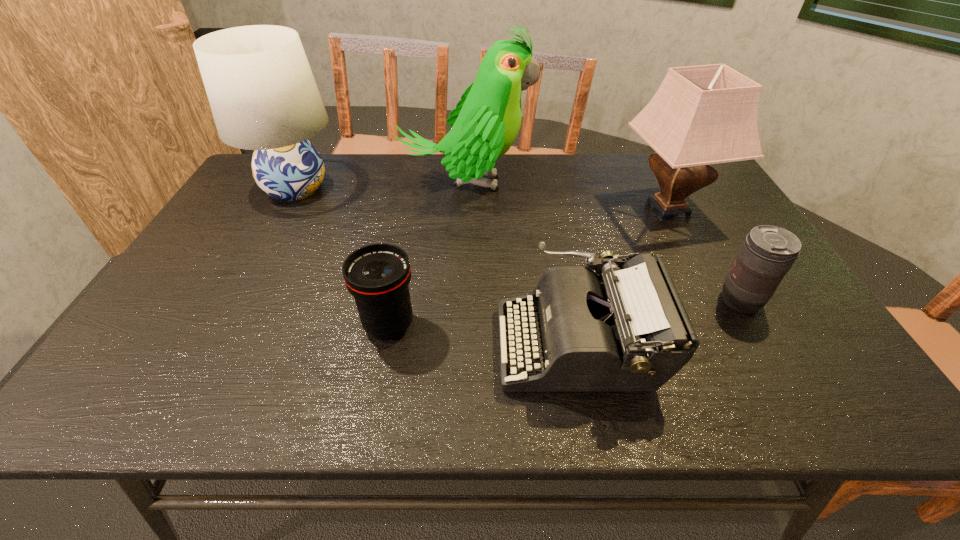
What are the coordinates of `telephoto lens present at the right edge` in the screenshot? It's located at (768, 252).

Locate an element on the screen. The width and height of the screenshot is (960, 540). object present at the far left corner is located at coordinates (263, 96).

Where is `object at the far right corner`? The height and width of the screenshot is (540, 960). object at the far right corner is located at coordinates (700, 115).

You are a GUI agent. You are given a task and a screenshot of the screen. Output one action in this format:
    pyautogui.click(x=<x>, y=<y>)
    Task: Click on the free space at the far edge of the desktop
    
    Given the screenshot: What is the action you would take?
    pos(639,166)

The image size is (960, 540). I want to click on vacant space at the near edge of the desktop, so click(600, 400).

You are a GUI agent. You are given a task and a screenshot of the screen. Output one action in this format:
    pyautogui.click(x=<x>, y=<y>)
    Task: Click on the vacant space at the left edge of the desktop
    Image resolution: width=960 pixels, height=540 pixels.
    Given the screenshot: What is the action you would take?
    pyautogui.click(x=228, y=249)

The width and height of the screenshot is (960, 540). Identify the location of free space at the right edge of the desktop. (819, 357).

This screenshot has height=540, width=960. In order to click on free spot between the left lampshade and the parakeet in this screenshot , I will do `click(380, 186)`.

At what (x,y) coordinates should I click in order to perform the action: click on vacant space in between the parakeet and the left telephoto lens. Please return your answer as a coordinate pair (x, y). This screenshot has width=960, height=540. Looking at the image, I should click on (427, 254).

Locate an element on the screen. The height and width of the screenshot is (540, 960). vacant space that is in between the parakeet and the left lampshade is located at coordinates (380, 186).